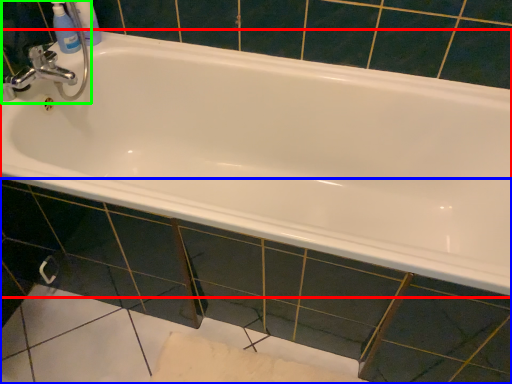
Question: Which object is the closest to the bathtub (highlighted by a red box)? Choose among these: tile (highlighted by a blue box) or sink (highlighted by a green box).

Choices:
 (A) tile
 (B) sink

Answer: (A)